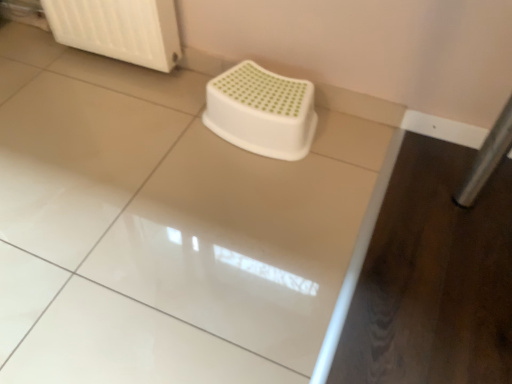
Question: From a real-world perspective, is white plastic stool at center positioned over white glossy counter top at center based on gravity?

Choices:
 (A) yes
 (B) no

Answer: (A)

Question: Can you confirm if white plastic stool at center is smaller than white glossy counter top at center?

Choices:
 (A) yes
 (B) no

Answer: (A)

Question: Is white plastic stool at center positioned behind white glossy counter top at center?

Choices:
 (A) no
 (B) yes

Answer: (B)

Question: Could you tell me if white plastic stool at center is turned towards white glossy counter top at center?

Choices:
 (A) yes
 (B) no

Answer: (A)

Question: Is white glossy counter top at center surrounded by white plastic stool at center?

Choices:
 (A) no
 (B) yes

Answer: (A)

Question: Would you say white plastic radiator at upper left is to the left or to the right of white plastic stool at center in the picture?

Choices:
 (A) right
 (B) left

Answer: (B)

Question: From the image's perspective, relative to white plastic stool at center, is white plastic radiator at upper left above or below?

Choices:
 (A) above
 (B) below

Answer: (A)

Question: In terms of width, does white plastic radiator at upper left look wider or thinner when compared to white plastic stool at center?

Choices:
 (A) thin
 (B) wide

Answer: (A)

Question: Would you say white plastic radiator at upper left is inside or outside white plastic stool at center?

Choices:
 (A) inside
 (B) outside

Answer: (B)

Question: From a real-world perspective, is white plastic stool at center positioned above or below white glossy counter top at center?

Choices:
 (A) above
 (B) below

Answer: (A)

Question: Is white plastic stool at center taller or shorter than white glossy counter top at center?

Choices:
 (A) tall
 (B) short

Answer: (A)

Question: Is white plastic stool at center wider or thinner than white glossy counter top at center?

Choices:
 (A) wide
 (B) thin

Answer: (B)

Question: Considering their positions, is white plastic stool at center located in front of or behind white glossy counter top at center?

Choices:
 (A) behind
 (B) front

Answer: (A)

Question: Is white glossy counter top at center bigger or smaller than white plastic stool at center?

Choices:
 (A) small
 (B) big

Answer: (B)

Question: In the image, is white glossy counter top at center positioned in front of or behind white plastic stool at center?

Choices:
 (A) front
 (B) behind

Answer: (A)